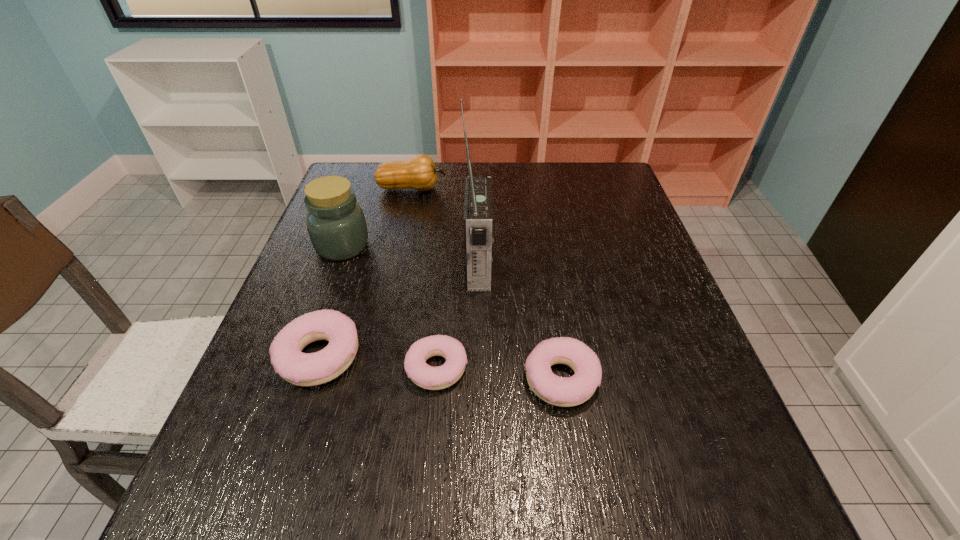
The height and width of the screenshot is (540, 960). Identify the location of free spot between the second doughnut from left to right and the leftmost doughnut. (378, 363).

The image size is (960, 540). Find the location of `vacant space that is in between the second doughnut from left to right and the gourd`. vacant space that is in between the second doughnut from left to right and the gourd is located at coordinates (424, 278).

Image resolution: width=960 pixels, height=540 pixels. Find the location of `empty location between the second tallest doughnut and the jar`. empty location between the second tallest doughnut and the jar is located at coordinates (452, 313).

Identify which object is located as the nearest to the second tallest doughnut. Please provide its 2D coordinates. Your answer should be formatted as a tuple, i.e. [(x, y)], where the tuple contains the x and y coordinates of a point satisfying the conditions above.

[(432, 378)]

Identify which object is the closest to the radio receiver. Please provide its 2D coordinates. Your answer should be formatted as a tuple, i.e. [(x, y)], where the tuple contains the x and y coordinates of a point satisfying the conditions above.

[(432, 378)]

Where is `the closest doughnut to the rightmost doughnut`? This screenshot has width=960, height=540. the closest doughnut to the rightmost doughnut is located at coordinates (432, 378).

I want to click on doughnut that is the third nearest to the radio receiver, so click(x=302, y=369).

Locate an element on the screen. The width and height of the screenshot is (960, 540). blank area in the image that satisfies the following two spatial constraints: 1. on the stem side of the farthest object; 2. on the left side of the rightmost doughnut is located at coordinates (372, 380).

You are a GUI agent. You are given a task and a screenshot of the screen. Output one action in this format:
    pyautogui.click(x=<x>, y=<y>)
    Task: Click on the free space that satisfies the following two spatial constraints: 1. on the stem side of the shortest doughnut; 2. on the right side of the third tallest object
    The image size is (960, 540).
    Given the screenshot: What is the action you would take?
    pyautogui.click(x=374, y=368)

Locate an element on the screen. The image size is (960, 540). free space that satisfies the following two spatial constraints: 1. on the back side of the rightmost doughnut; 2. on the display of the tallest object is located at coordinates (543, 266).